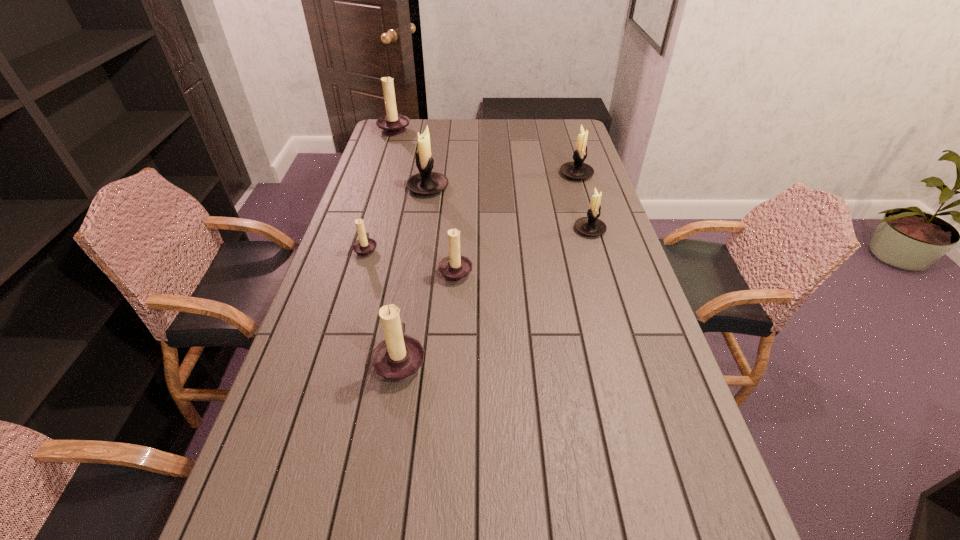
This screenshot has width=960, height=540. I want to click on free space at the far edge of the desktop, so click(538, 120).

Identify the location of vacant space at the left edge. The height and width of the screenshot is (540, 960). (398, 145).

Find the location of `free spot at the right edge of the desktop`. free spot at the right edge of the desktop is located at coordinates (619, 251).

Where is `empty location between the leftmost white candle holder and the farthest brown candle holder`? empty location between the leftmost white candle holder and the farthest brown candle holder is located at coordinates (412, 158).

This screenshot has height=540, width=960. Identify the location of vacant region between the leftmost white candle holder and the rightmost brown candle holder. (442, 229).

What are the coordinates of `free space between the second smallest white candle holder and the biggest white candle holder` in the screenshot? It's located at (502, 181).

The height and width of the screenshot is (540, 960). In order to click on vacant point located between the nearest white candle holder and the second biggest white candle holder in this screenshot , I will do `click(583, 202)`.

Identify the location of the sixth closest object to the smallest brown candle holder. (393, 124).

Identify which object is located as the fifth nearest to the leftmost white candle holder. Please provide its 2D coordinates. Your answer should be formatted as a tuple, i.e. [(x, y)], where the tuple contains the x and y coordinates of a point satisfying the conditions above.

[(590, 226)]

The width and height of the screenshot is (960, 540). Identify the location of candle holder that is the third closest to the biggest white candle holder. (393, 124).